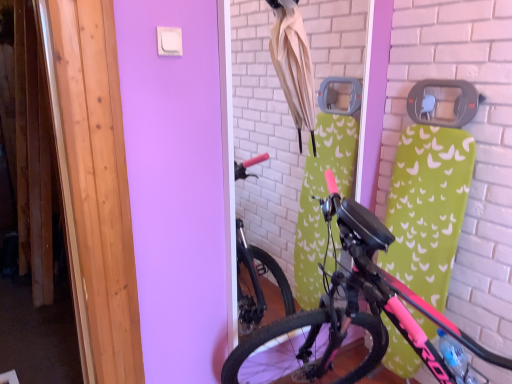
Question: Is beige fabric umbrella at upper center thinner than pink matte bicycle at center?

Choices:
 (A) no
 (B) yes

Answer: (B)

Question: Is beige fabric umbrella at upper center taller than pink matte bicycle at center?

Choices:
 (A) no
 (B) yes

Answer: (A)

Question: From a real-world perspective, is beige fabric umbrella at upper center physically below pink matte bicycle at center?

Choices:
 (A) no
 (B) yes

Answer: (A)

Question: Is beige fabric umbrella at upper center directly adjacent to pink matte bicycle at center?

Choices:
 (A) no
 (B) yes

Answer: (A)

Question: Can you confirm if beige fabric umbrella at upper center is positioned to the right of pink matte bicycle at center?

Choices:
 (A) no
 (B) yes

Answer: (A)

Question: Does beige fabric umbrella at upper center have a lesser height compared to pink matte bicycle at center?

Choices:
 (A) no
 (B) yes

Answer: (B)

Question: Is pink matte bicycle at center taller than beige fabric umbrella at upper center?

Choices:
 (A) no
 (B) yes

Answer: (B)

Question: Considering the relative sizes of pink matte bicycle at center and beige fabric umbrella at upper center in the image provided, is pink matte bicycle at center bigger than beige fabric umbrella at upper center?

Choices:
 (A) yes
 (B) no

Answer: (A)

Question: Is pink matte bicycle at center smaller than beige fabric umbrella at upper center?

Choices:
 (A) no
 (B) yes

Answer: (A)

Question: Can you confirm if pink matte bicycle at center is thinner than beige fabric umbrella at upper center?

Choices:
 (A) yes
 (B) no

Answer: (B)

Question: Is pink matte bicycle at center positioned in front of beige fabric umbrella at upper center?

Choices:
 (A) yes
 (B) no

Answer: (A)

Question: From the image's perspective, is pink matte bicycle at center beneath beige fabric umbrella at upper center?

Choices:
 (A) no
 (B) yes

Answer: (B)

Question: Is point (285, 59) closer or farther from the camera than point (232, 354)?

Choices:
 (A) closer
 (B) farther

Answer: (A)